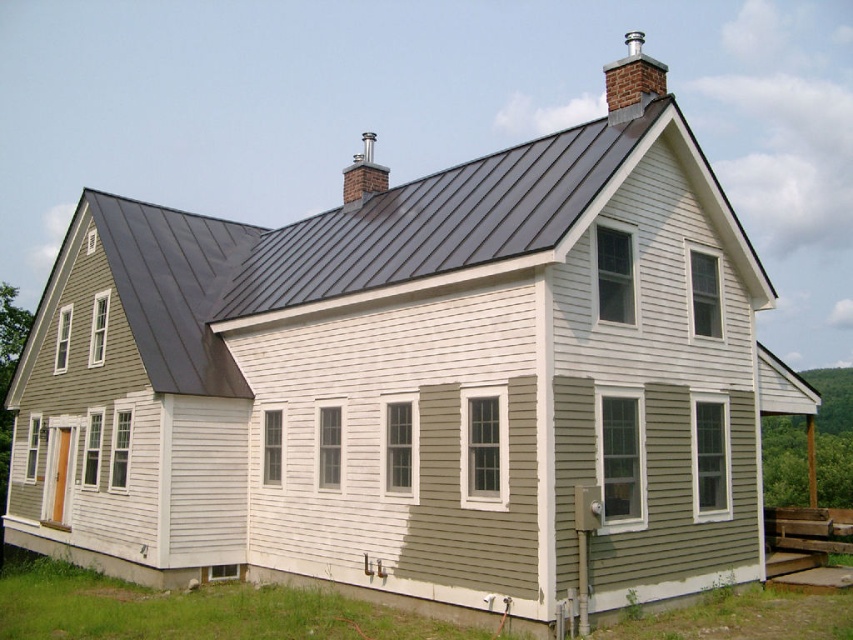
Question: Can you confirm if silver metallic chimney at upper right is smaller than smooth silver chimney at upper center?

Choices:
 (A) no
 (B) yes

Answer: (A)

Question: Is silver metallic chimney at upper right wider than smooth silver chimney at upper center?

Choices:
 (A) no
 (B) yes

Answer: (B)

Question: In this image, where is silver metallic chimney at upper right located relative to smooth silver chimney at upper center?

Choices:
 (A) right
 (B) left

Answer: (A)

Question: Which point is farther to the camera?

Choices:
 (A) (352, 177)
 (B) (619, 68)

Answer: (A)

Question: Which point is closer to the camera?

Choices:
 (A) smooth silver chimney at upper center
 (B) silver metallic chimney at upper right

Answer: (B)